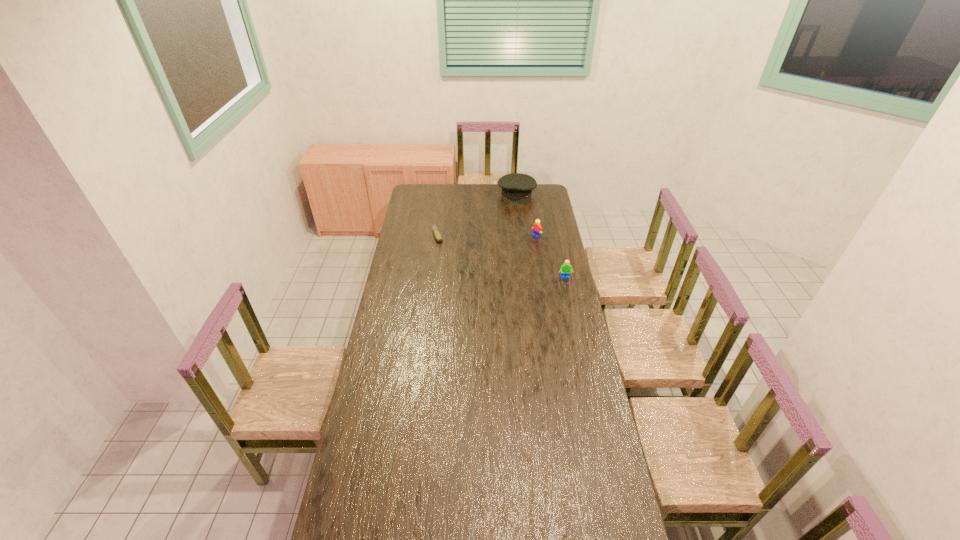
The image size is (960, 540). In the image, there is a desktop. In order to click on vacant region at the far left corner in this screenshot , I will do `click(424, 195)`.

You are a GUI agent. You are given a task and a screenshot of the screen. Output one action in this format:
    pyautogui.click(x=<x>, y=<y>)
    Task: Click on the free area in between the nearest object and the farthest object
    The height and width of the screenshot is (540, 960).
    Given the screenshot: What is the action you would take?
    pyautogui.click(x=540, y=236)

Where is `vacant point located between the shortest object and the beret`? The width and height of the screenshot is (960, 540). vacant point located between the shortest object and the beret is located at coordinates (477, 215).

Find the location of a particular element. This screenshot has width=960, height=540. unoccupied position between the left Lego and the pocketknife is located at coordinates (487, 235).

What are the coordinates of `free space between the shortest object and the farther Lego` in the screenshot? It's located at (487, 235).

Locate an element on the screen. The width and height of the screenshot is (960, 540). free space between the farther Lego and the beret is located at coordinates (526, 215).

Identify the location of vacant point located between the pocketknife and the rightmost object. (501, 256).

At what (x,y) coordinates should I click in order to perform the action: click on free space between the right Lego and the farther Lego. Please return your answer as a coordinate pair (x, y). Image resolution: width=960 pixels, height=540 pixels. Looking at the image, I should click on (551, 257).

Locate an element on the screen. The height and width of the screenshot is (540, 960). free spot between the pocketknife and the farthest object is located at coordinates (477, 215).

The image size is (960, 540). Find the location of `vacant space in between the leftmost object and the right Lego`. vacant space in between the leftmost object and the right Lego is located at coordinates (501, 256).